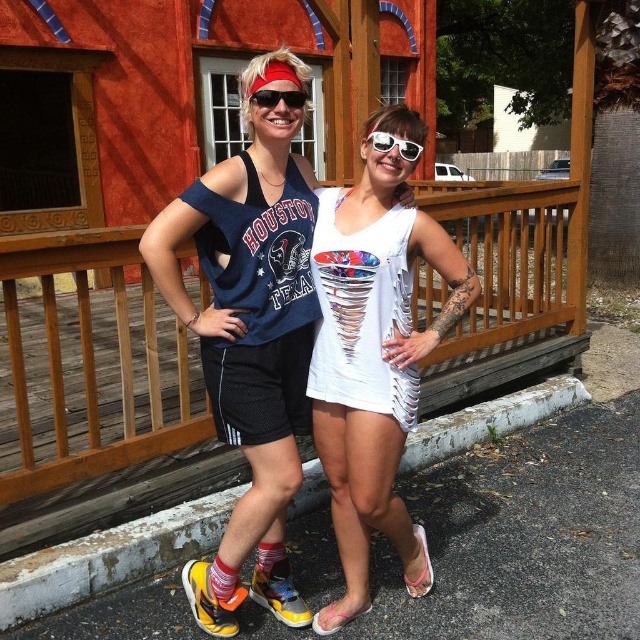
Which is more to the left, white reflective sunglasses at center or red reflective sunglasses at center?

red reflective sunglasses at center

I want to click on white reflective sunglasses at center, so click(x=394, y=145).

Is point (392, 144) farther from viewer compared to point (260, 99)?

That is True.

The width and height of the screenshot is (640, 640). I want to click on white reflective sunglasses at center, so click(394, 145).

Find the location of a particular element. The image size is (640, 640). matte black tank top at center is located at coordinates (252, 336).

Between matte black tank top at center and white textured dress at center, which one has more height?

Standing taller between the two is matte black tank top at center.

Where is `matte black tank top at center`? matte black tank top at center is located at coordinates coord(252,336).

Identify the location of matte black tank top at center. The image size is (640, 640). (252, 336).

From the picture: Between matte black tank top at center and wooden rail at center, which one appears on the right side from the viewer's perspective?

Positioned to the right is wooden rail at center.

Which is behind, point (406, 340) or point (465, 211)?

The point (465, 211) is more distant.

This screenshot has height=640, width=640. What do you see at coordinates (252, 336) in the screenshot?
I see `matte black tank top at center` at bounding box center [252, 336].

Where is `matte black tank top at center`? Image resolution: width=640 pixels, height=640 pixels. matte black tank top at center is located at coordinates (252, 336).